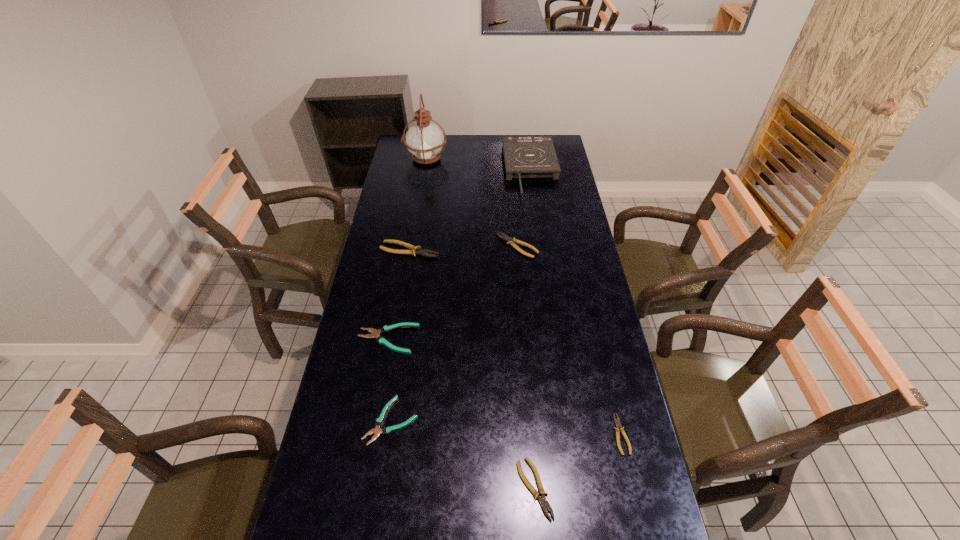
Select which yellow pliers is the closest to the smaller teal pliers. Please provide its 2D coordinates. Your answer should be formatted as a tuple, i.e. [(x, y)], where the tuple contains the x and y coordinates of a point satisfying the conditions above.

[(542, 500)]

Where is `the second closest yellow pliers relative to the seventh shortest object`? the second closest yellow pliers relative to the seventh shortest object is located at coordinates (x=414, y=250).

Identify the location of teal pliers that is the closest to the oil lamp. (375, 334).

Identify the location of teal pliers identified as the second closest to the third biggest yellow pliers. This screenshot has width=960, height=540. (375, 334).

Locate an element on the screen. The width and height of the screenshot is (960, 540). free spot that satisfies the following two spatial constraints: 1. on the front side of the smaller teal pliers; 2. on the right side of the oil lamp is located at coordinates (384, 420).

I want to click on free space that satisfies the following two spatial constraints: 1. on the back side of the hotplate; 2. on the right side of the leftmost yellow pliers, so click(422, 171).

Find the location of a particular element. vacant area in the image that satisfies the following two spatial constraints: 1. on the back side of the oil lamp; 2. on the left side of the sixth shortest object is located at coordinates (424, 159).